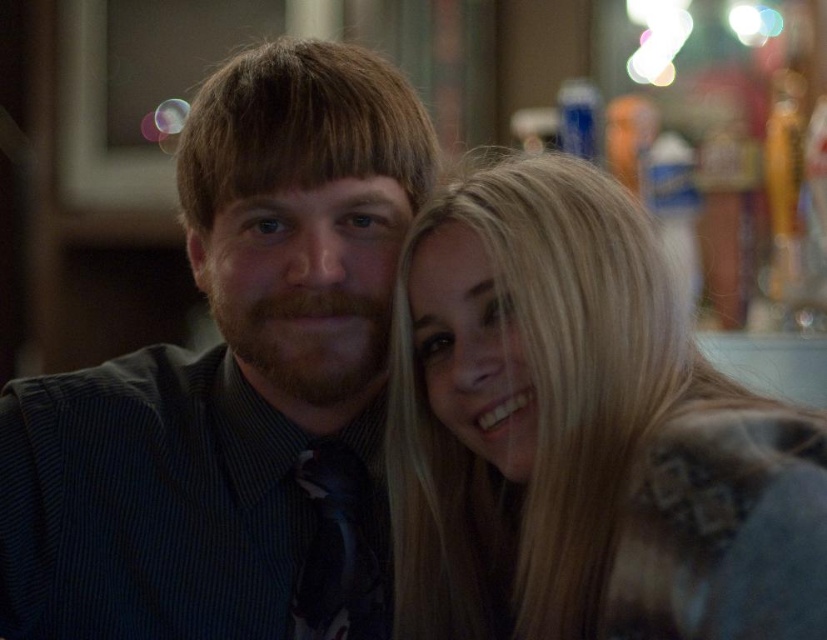
You are a photographer adjusting your camera settings. The matte black shirt at center is positioned at coordinates point 0.602, 0.284. To ensure proper focus, you need to know if this point is within the camera frame. The camera frame has a width of 1.0 and height of 1.0, with the origin at the bottom left corner. Is the point within the frame?

The point (233,385) falls within the camera frame since both coordinates are between 0 and 1.0, so yes, the matte black shirt at center is within the frame.

You are a photographer adjusting the lighting in this scene. You need to ensure that both the blonde hair at upper right and the matte black tie at center are equally visible. Considering their positions, which object is closer to the light source?

The blonde hair at upper right is positioned on the right side of matte black tie at center, so it is farther from the light source. To balance visibility, adjust the lighting to illuminate the matte black tie at center more directly while ensuring the blonde hair at upper right receives sufficient indirect light.

You are a photographer trying to capture a clear shot of both the matte black shirt at center and the matte black tie at center. Since you want to ensure both are fully visible in the frame, which object should you adjust your focus on first to account for their sizes?

The matte black shirt at center is wider than the matte black tie at center, so you should focus on the matte black shirt at center first to ensure its entire width fits in the frame before adjusting for the smaller matte black tie at center.